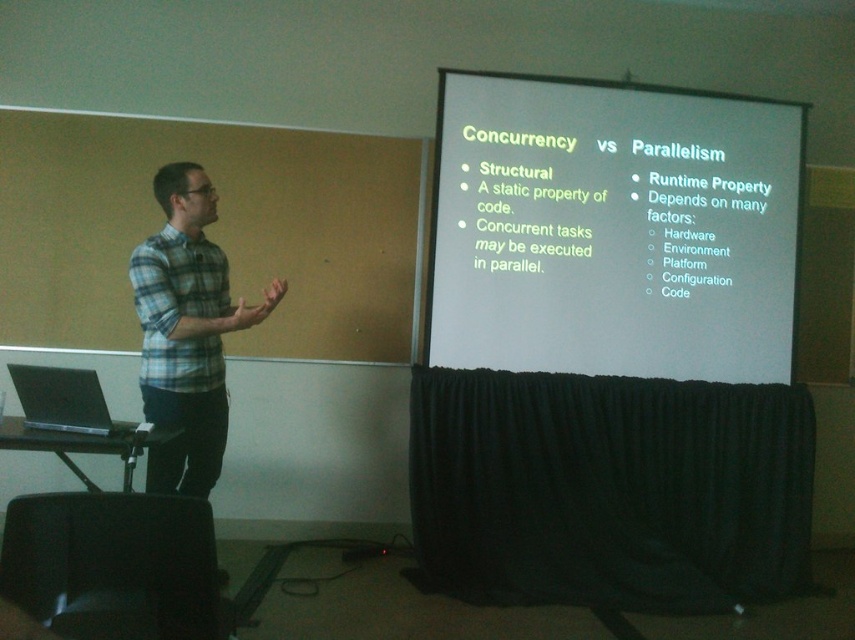
Question: Which of the following is the closest to the observer?

Choices:
 (A) (190, 376)
 (B) (158, 380)
 (C) (105, 433)
 (D) (453, 92)

Answer: (C)

Question: Among these points, which one is nearest to the camera?

Choices:
 (A) (9, 364)
 (B) (180, 275)

Answer: (B)

Question: Which point is closer to the camera?

Choices:
 (A) blue plaid shirt at left
 (B) matte black laptop at left
 (C) white matte projector screen at upper center

Answer: (B)

Question: Is plaid cotton shirt at left to the left of matte black laptop at left from the viewer's perspective?

Choices:
 (A) yes
 (B) no

Answer: (B)

Question: Is plaid cotton shirt at left closer to the viewer compared to matte black laptop at left?

Choices:
 (A) yes
 (B) no

Answer: (B)

Question: Is blue plaid shirt at left above plaid cotton shirt at left?

Choices:
 (A) no
 (B) yes

Answer: (A)